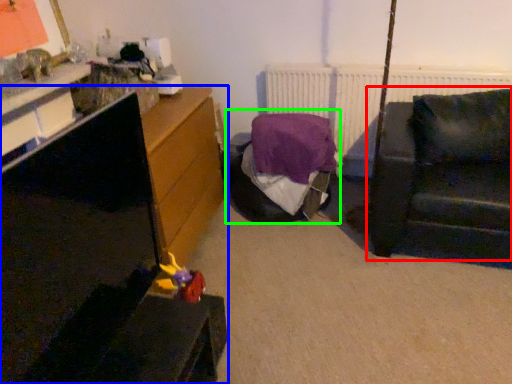
Question: Which object is positioned farthest from studio couch (highlighted by a red box)? Select from furniture (highlighted by a blue box) and bed (highlighted by a green box).

Choices:
 (A) furniture
 (B) bed

Answer: (A)